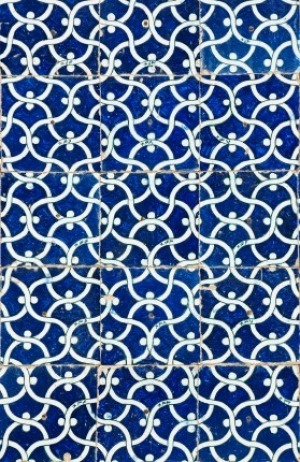
Find the location of a particular element. row 5 of tile is located at coordinates (150, 409).